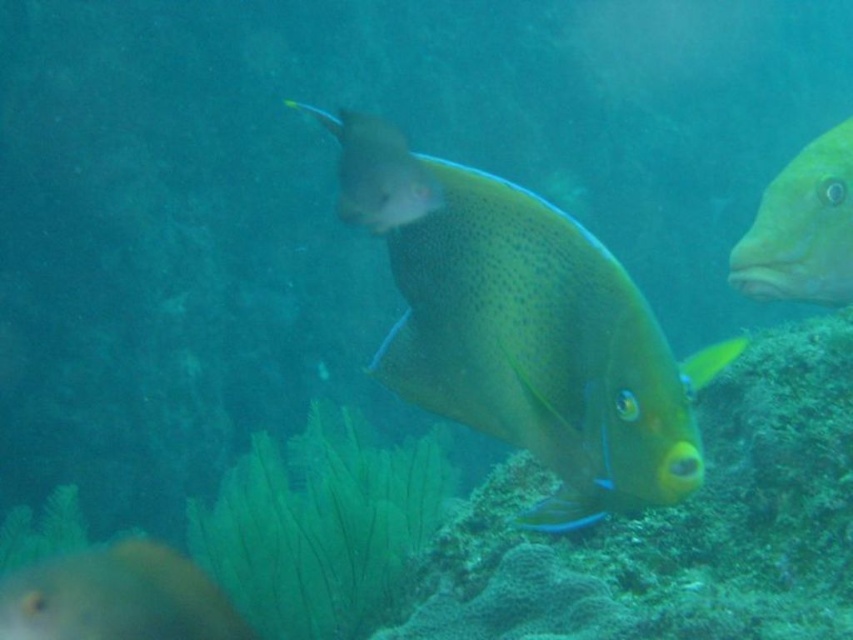
Looking at this image, you are a marine biologist observing the underwater scene. You notice the translucent yellow fish at center and the yellow matte fish at right. Which fish is bigger in size?

The translucent yellow fish at center is larger in size compared to the yellow matte fish at right.

You are a marine biologist observing underwater. You have a net that can reach up to 1 meter. Can you catch both the shiny yellow fish at center and the yellow matte fish at right with a single throw?

The shiny yellow fish at center is 1.22 meters away from the yellow matte fish at right. Since the net can only reach up to 1 meter, you cannot catch both with a single throw because the distance between them exceeds the net range.